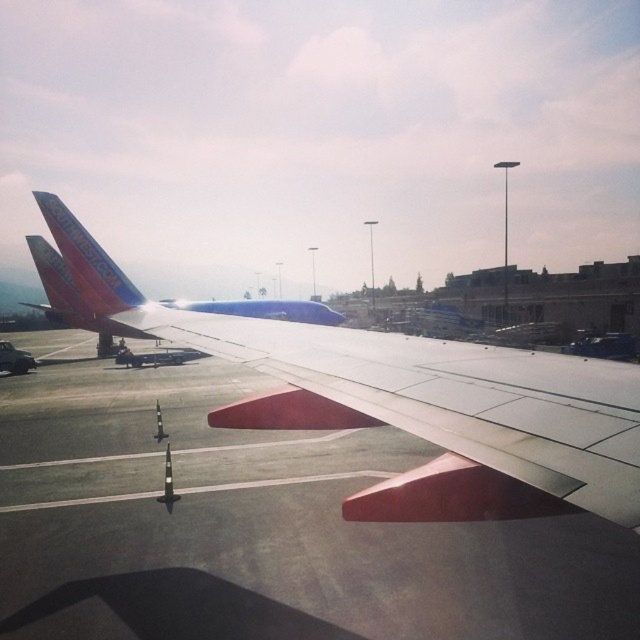
Question: Is smooth concrete tarmac at center closer to camera compared to matte white wing at center?

Choices:
 (A) yes
 (B) no

Answer: (B)

Question: Is smooth concrete tarmac at center closer to the viewer compared to matte white wing at center?

Choices:
 (A) yes
 (B) no

Answer: (B)

Question: In this image, where is smooth concrete tarmac at center located relative to matte white wing at center?

Choices:
 (A) right
 (B) left

Answer: (A)

Question: Which point is closer to the camera?

Choices:
 (A) matte white wing at center
 (B) smooth concrete tarmac at center

Answer: (A)